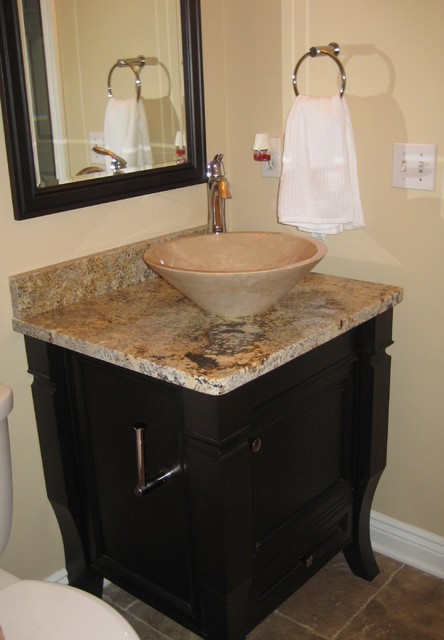
Locate an element on the screen. towel is located at coordinates (348, 152).